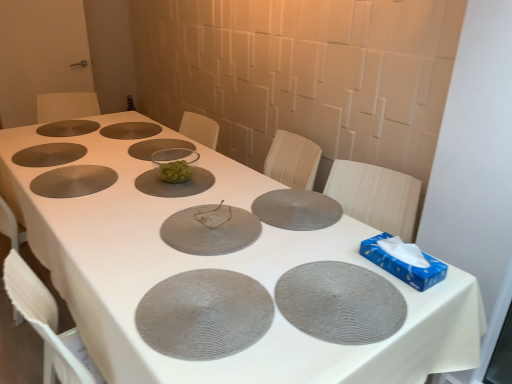
Where is `vacant space that's between matte gray plate at upper left, positioned as the fourth glass plate in back-to-front order, and matte gray placemat at center, acting as the 7th glass plate starting from the back`? The image size is (512, 384). vacant space that's between matte gray plate at upper left, positioned as the fourth glass plate in back-to-front order, and matte gray placemat at center, acting as the 7th glass plate starting from the back is located at coordinates (142, 176).